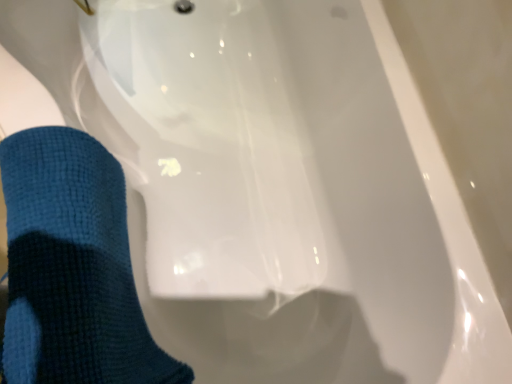
Where is `blue textured sock at lower left`? blue textured sock at lower left is located at coordinates (72, 267).

What do you see at coordinates (72, 267) in the screenshot? Image resolution: width=512 pixels, height=384 pixels. I see `blue textured sock at lower left` at bounding box center [72, 267].

Locate an element on the screen. The image size is (512, 384). blue textured sock at lower left is located at coordinates (72, 267).